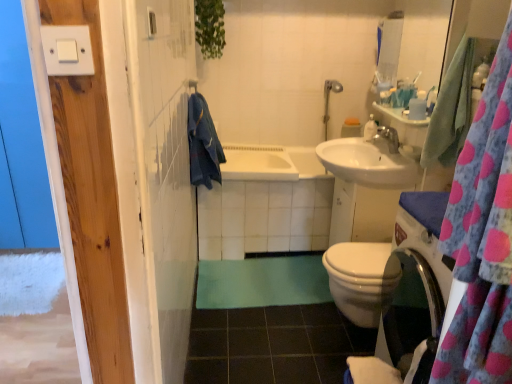
This screenshot has width=512, height=384. What are the coordinates of `white glossy bathtub at center, which appears as the 1th bath when viewed from the top` in the screenshot? It's located at (258, 163).

Locate an element on the screen. silver metallic shower head at upper right is located at coordinates (328, 101).

Where is `glossy ceramic mirror at upper right`? This screenshot has height=384, width=512. glossy ceramic mirror at upper right is located at coordinates (417, 42).

What do you see at coordinates (273, 345) in the screenshot? I see `green rubber mat at lower center` at bounding box center [273, 345].

What do you see at coordinates (370, 160) in the screenshot? I see `white glossy sink at center right` at bounding box center [370, 160].

The image size is (512, 384). Identify the location of white glossy sink at upper right. (399, 115).

You are a GUI agent. You are given a task and a screenshot of the screen. Output one action in this format:
    pyautogui.click(x=<x>, y=<y>)
    Task: Click on the silver metallic faucet at upper center
    The height and width of the screenshot is (384, 512).
    Given the screenshot: What is the action you would take?
    pyautogui.click(x=386, y=140)

This screenshot has width=512, height=384. I want to click on white glossy bathtub at center, which ranks as the second bath in bottom-to-top order, so click(x=258, y=163).

Is green rubber mat at lower center oriented towards glossy ceramic mirror at upper right?

No, green rubber mat at lower center is not aimed at glossy ceramic mirror at upper right.

You are a GUI agent. You are given a task and a screenshot of the screen. Output one action in this format:
    pyautogui.click(x=<x>, y=<y>)
    Task: Click on the tile in front of the glossy ceramic mirror at upper right
    This screenshot has width=512, height=384.
    Given the screenshot: What is the action you would take?
    pyautogui.click(x=273, y=345)

Is glossy ceramic mirror at upper right located within green rubber mat at lower center?

No, glossy ceramic mirror at upper right is not a part of green rubber mat at lower center.

Based on their positions, is green fabric bath mat at center located to the left or right of teal fabric towel at upper right, arranged as the first bath towel when viewed from the right?

Based on their positions, green fabric bath mat at center is located to the left of teal fabric towel at upper right, arranged as the first bath towel when viewed from the right.

From a real-world perspective, who is located lower, green fabric bath mat at center or teal fabric towel at upper right, which is counted as the first bath towel, starting from the front?

green fabric bath mat at center.

Considering the positions of point (282, 266) and point (443, 129), is point (282, 266) closer or farther from the camera than point (443, 129)?

Point (282, 266) is positioned farther from the camera compared to point (443, 129).

From the image's perspective, is green fabric bath mat at center positioned above or below teal fabric towel at upper right, which is the second bath towel from left to right?

green fabric bath mat at center is below teal fabric towel at upper right, which is the second bath towel from left to right.

You are a GUI agent. You are given a task and a screenshot of the screen. Output one action in this format:
    pyautogui.click(x=<x>, y=<y>)
    Task: Click on the bath that is the 2nd one when counting downward from the glossy ceramic mirror at upper right (from the image's perspective)
    This screenshot has width=512, height=384.
    Given the screenshot: What is the action you would take?
    pyautogui.click(x=265, y=203)

Which is more to the left, white ceramic bathtub at center, which ranks as the first bath in bottom-to-top order, or glossy ceramic mirror at upper right?

white ceramic bathtub at center, which ranks as the first bath in bottom-to-top order.

Considering the positions of point (298, 208) and point (430, 15), is point (298, 208) closer or farther from the camera than point (430, 15)?

Point (298, 208) is positioned closer to the camera compared to point (430, 15).

Based on the photo, is glossy ceramic mirror at upper right a part of white ceramic bathtub at center, which appears as the 2th bath when viewed from the top?

That's incorrect, glossy ceramic mirror at upper right is not inside white ceramic bathtub at center, which appears as the 2th bath when viewed from the top.

Is point (401, 114) less distant than point (332, 323)?

Yes.

Does white glossy sink at upper right have a greater height compared to green rubber mat at lower center?

Yes, white glossy sink at upper right is taller than green rubber mat at lower center.

Is white glossy sink at upper right beside green rubber mat at lower center?

No, white glossy sink at upper right is not touching green rubber mat at lower center.

You are a GUI agent. You are given a task and a screenshot of the screen. Output one action in this format:
    pyautogui.click(x=<x>, y=<y>)
    Task: Click on the counter top on the right side of green rubber mat at lower center
    This screenshot has width=512, height=384.
    Given the screenshot: What is the action you would take?
    pyautogui.click(x=399, y=115)

Is white glossy bathtub at center, which appears as the 1th bath when viewed from the top, at the left side of green rubber mat at lower center?

Yes, white glossy bathtub at center, which appears as the 1th bath when viewed from the top, is to the left of green rubber mat at lower center.

Considering the positions of points (271, 153) and (274, 314), is point (271, 153) farther from camera compared to point (274, 314)?

Yes, point (271, 153) is behind point (274, 314).

Does white glossy bathtub at center, which appears as the 1th bath when viewed from the top, have a larger size compared to green rubber mat at lower center?

Yes.

Is white glossy bathtub at center, which appears as the 1th bath when viewed from the top, positioned far away from green rubber mat at lower center?

Yes, white glossy bathtub at center, which appears as the 1th bath when viewed from the top, and green rubber mat at lower center are quite far apart.

Is white plastic light switch at upper left bigger than white ceramic bathtub at center, which ranks as the first bath in bottom-to-top order?

Incorrect, white plastic light switch at upper left is not larger than white ceramic bathtub at center, which ranks as the first bath in bottom-to-top order.

Can you tell me how much white plastic light switch at upper left and white ceramic bathtub at center, which ranks as the first bath in bottom-to-top order, differ in facing direction?

The angular difference between white plastic light switch at upper left and white ceramic bathtub at center, which ranks as the first bath in bottom-to-top order, is 1.77 degrees.

This screenshot has height=384, width=512. In order to click on the 1st bath behind the white plastic light switch at upper left in this screenshot , I will do `click(265, 203)`.

From the picture: From the image's perspective, is white plastic light switch at upper left located beneath white ceramic bathtub at center, which ranks as the first bath in bottom-to-top order?

Actually, white plastic light switch at upper left appears above white ceramic bathtub at center, which ranks as the first bath in bottom-to-top order, in the image.

Identify the location of light switch on the left of silver metallic shower head at upper right. This screenshot has width=512, height=384. (67, 50).

Considering the points (327, 86) and (92, 67), which point is behind, point (327, 86) or point (92, 67)?

The point (327, 86) is more distant.

Are silver metallic shower head at upper right and white plastic light switch at upper left beside each other?

silver metallic shower head at upper right and white plastic light switch at upper left are not in contact.

Considering the relative sizes of silver metallic shower head at upper right and white plastic light switch at upper left in the image provided, is silver metallic shower head at upper right smaller than white plastic light switch at upper left?

Incorrect, silver metallic shower head at upper right is not smaller in size than white plastic light switch at upper left.

Where is `mirror that is above the green rubber mat at lower center (from the image's perspective)`? mirror that is above the green rubber mat at lower center (from the image's perspective) is located at coordinates (417, 42).

In the image, there is a teal fabric towel at upper right, which is the 2th bath towel in back-to-front order. Where is `bath mat below it (from the image's perspective)`? The image size is (512, 384). bath mat below it (from the image's perspective) is located at coordinates (262, 282).

Which object lies further to the anchor point teal fabric towel at upper right, which is the 2th bath towel in back-to-front order, white glossy soap dispenser at upper right or pink polka dot fabric at right?

Among the two, pink polka dot fabric at right is located further to teal fabric towel at upper right, which is the 2th bath towel in back-to-front order.

Which object lies nearer to the anchor point silver metallic faucet at upper center, teal fabric towel at upper right, arranged as the first bath towel when viewed from the right, or silver metallic shower head at upper right?

Based on the image, silver metallic shower head at upper right appears to be nearer to silver metallic faucet at upper center.

From the image, which object appears to be nearer to white glossy sink at center right, glossy ceramic mirror at upper right or silver metallic shower head at upper right?

glossy ceramic mirror at upper right is positioned closer to the anchor white glossy sink at center right.

Based on their spatial positions, is white glossy bathtub at center, which appears as the 1th bath when viewed from the top, or white glossy sink at upper right further from white glossy sink at center right?

white glossy bathtub at center, which appears as the 1th bath when viewed from the top, lies further to white glossy sink at center right than the other object.

From the image, which object appears to be farther from white glossy sink at center right, green fabric bath mat at center or white glossy bathtub at center, which ranks as the second bath in bottom-to-top order?

green fabric bath mat at center is further to white glossy sink at center right.

When comparing their distances from silver metallic shower head at upper right, does white glossy sink at center right or teal fabric towel at upper right, which is the second bath towel from left to right, seem further?

teal fabric towel at upper right, which is the second bath towel from left to right, lies further to silver metallic shower head at upper right than the other object.

Looking at this image, which object lies nearer to the anchor point teal fabric towel at upper right, arranged as the first bath towel when viewed from the right, denim towel at center, the first bath towel viewed from the back, or silver metallic faucet at upper center?

Based on the image, silver metallic faucet at upper center appears to be nearer to teal fabric towel at upper right, arranged as the first bath towel when viewed from the right.

Based on their spatial positions, is silver metallic faucet at upper center or silver metallic shower head at upper right closer to glossy ceramic mirror at upper right?

silver metallic shower head at upper right lies closer to glossy ceramic mirror at upper right than the other object.

Find the location of a particular element. The height and width of the screenshot is (384, 512). sink between denim towel at center, the first bath towel viewed from the back, and teal fabric towel at upper right, which is the 2th bath towel in back-to-front order, from left to right is located at coordinates coord(370,160).

Where is `shower between denim towel at center, the second bath towel in the front-to-back sequence, and white glossy sink at upper right from left to right`? The image size is (512, 384). shower between denim towel at center, the second bath towel in the front-to-back sequence, and white glossy sink at upper right from left to right is located at coordinates (328, 101).

The image size is (512, 384). I want to click on bath mat between white plastic light switch at upper left and white ceramic bathtub at center, which ranks as the first bath in bottom-to-top order, from front to back, so click(x=262, y=282).

The image size is (512, 384). Identify the location of mirror between white plastic light switch at upper left and white ceramic bathtub at center, which ranks as the first bath in bottom-to-top order, in the front-back direction. (417, 42).